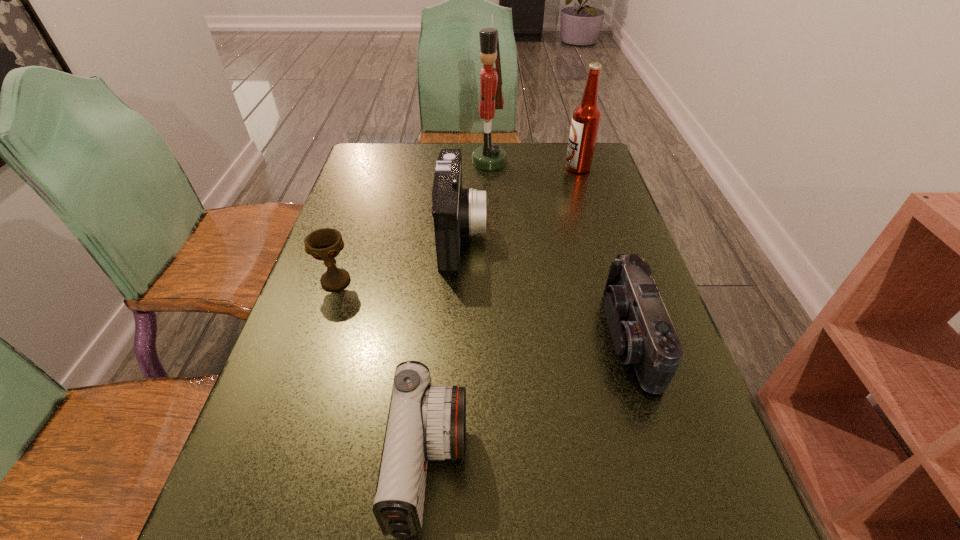
Find the location of a particular element. The width and height of the screenshot is (960, 540). the tallest object is located at coordinates (490, 156).

Identify the location of the fifth shortest object. (586, 118).

Locate an element on the screen. the farthest camcorder is located at coordinates (456, 211).

The width and height of the screenshot is (960, 540). Identify the location of the fourth shortest object. (456, 211).

Locate an element on the screen. The image size is (960, 540). the rightmost camcorder is located at coordinates (642, 333).

What are the coordinates of `chalice` in the screenshot? It's located at (324, 244).

The width and height of the screenshot is (960, 540). I want to click on vacant area located on the front-facing side of the nutcracker, so click(x=441, y=162).

Where is `vacant area situated on the front-facing side of the nutcracker`? The width and height of the screenshot is (960, 540). vacant area situated on the front-facing side of the nutcracker is located at coordinates (360, 162).

This screenshot has width=960, height=540. I want to click on vacant space located 0.240m on the front-facing side of the nutcracker, so click(397, 162).

In order to click on free location located 0.080m on the label side of the alcohol in this screenshot , I will do `click(540, 167)`.